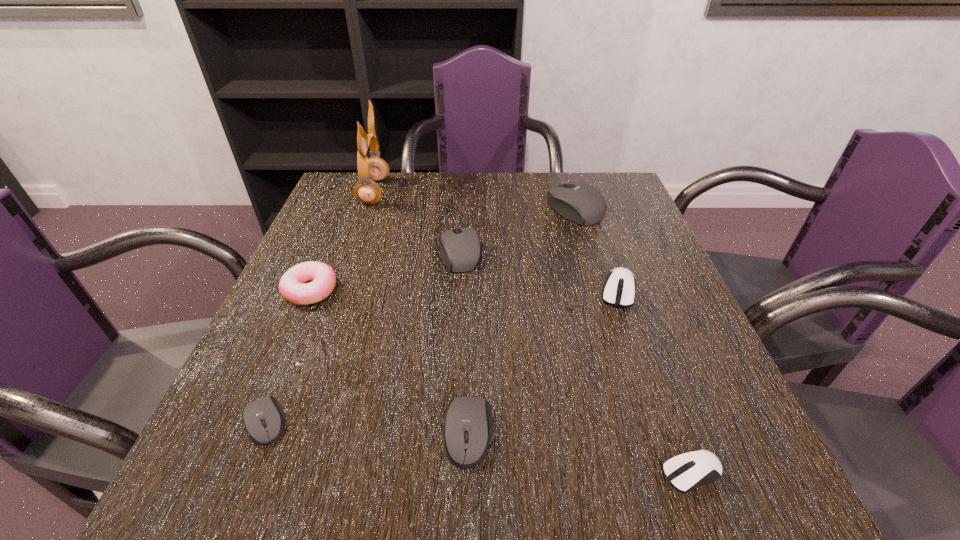
At what (x,y) coordinates should I click in order to perform the action: click on brown earphone. Please return your answer as a coordinate pair (x, y). Image resolution: width=960 pixels, height=540 pixels. Looking at the image, I should click on (367, 191).

Locate an element on the screen. the tallest object is located at coordinates (367, 191).

You are a GUI agent. You are given a task and a screenshot of the screen. Output one action in this format:
    pyautogui.click(x=<x>, y=<y>)
    Task: Click on the biggest black computer equipment
    This screenshot has height=540, width=960.
    Given the screenshot: What is the action you would take?
    tap(579, 202)

The width and height of the screenshot is (960, 540). Identify the location of the tallest computer equipment. (579, 202).

The width and height of the screenshot is (960, 540). I want to click on the second biggest black computer equipment, so click(460, 249).

This screenshot has height=540, width=960. What are the coordinates of `pink doughnut` in the screenshot? It's located at (292, 286).

Where is `the bigger white mouse`? The image size is (960, 540). the bigger white mouse is located at coordinates (619, 290).

The width and height of the screenshot is (960, 540). I want to click on the third biggest black computer equipment, so click(x=468, y=425).

You are a GUI agent. You are given a task and a screenshot of the screen. Output one action in this format:
    pyautogui.click(x=<x>, y=<y>)
    Task: Click on the smaller white mouse
    Image resolution: width=960 pixels, height=540 pixels.
    Given the screenshot: What is the action you would take?
    pyautogui.click(x=686, y=471)

This screenshot has height=540, width=960. I want to click on the smallest black computer equipment, so click(x=266, y=408).